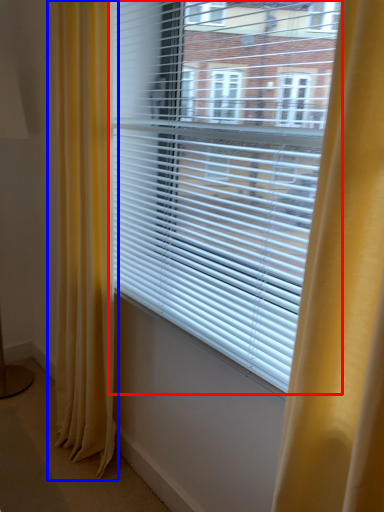
Question: Which object appears farthest to the camera in this image, window blind (highlighted by a red box) or curtain (highlighted by a blue box)?

Choices:
 (A) window blind
 (B) curtain

Answer: (B)